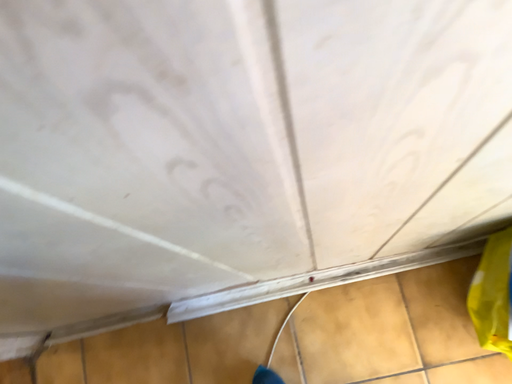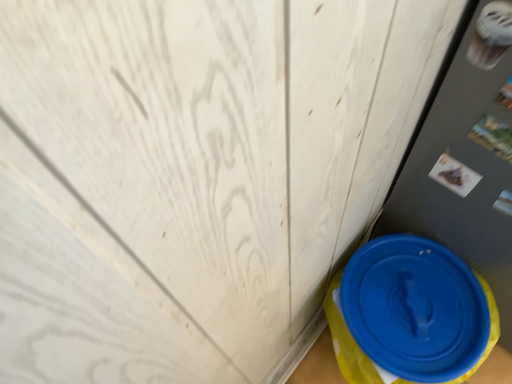
Question: Which way did the camera rotate in the video?

Choices:
 (A) rotated downward
 (B) rotated upward

Answer: (B)